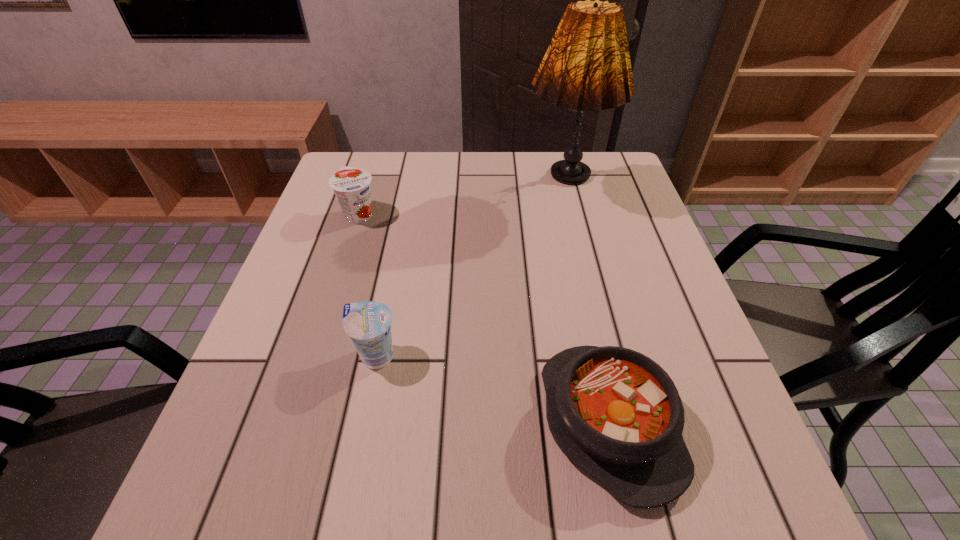
You are a GUI agent. You are given a task and a screenshot of the screen. Output one action in this format:
    pyautogui.click(x=<x>, y=<y>)
    Task: Click on the lampshade
    Image resolution: width=960 pixels, height=540 pixels.
    Given the screenshot: What is the action you would take?
    pyautogui.click(x=587, y=66)

Locate an element on the screen. the farther yogurt is located at coordinates (351, 186).

Locate an element on the screen. The width and height of the screenshot is (960, 540). the leftmost object is located at coordinates (351, 186).

I want to click on the second object from left to right, so click(368, 323).

Identify the location of the right yogurt. (368, 323).

Image resolution: width=960 pixels, height=540 pixels. Find the location of `casserole`. casserole is located at coordinates [x=615, y=413].

You are a GUI agent. You are given a task and a screenshot of the screen. Output one action in this format:
    pyautogui.click(x=<x>, y=<y>)
    Task: Click on the vacant space situated 0.380m on the front-facing side of the tallest object
    The height and width of the screenshot is (540, 960).
    Given the screenshot: What is the action you would take?
    pyautogui.click(x=600, y=340)

Identify the location of vacant space located 0.100m on the front of the farther yogurt. The height and width of the screenshot is (540, 960). (347, 255).

The height and width of the screenshot is (540, 960). In order to click on free location located 0.380m on the right of the right yogurt in this screenshot , I will do `click(599, 356)`.

At what (x,y) coordinates should I click in order to perform the action: click on free region located on the left of the casserole. Please return your answer as a coordinate pair (x, y). The image size is (960, 540). Looking at the image, I should click on (403, 422).